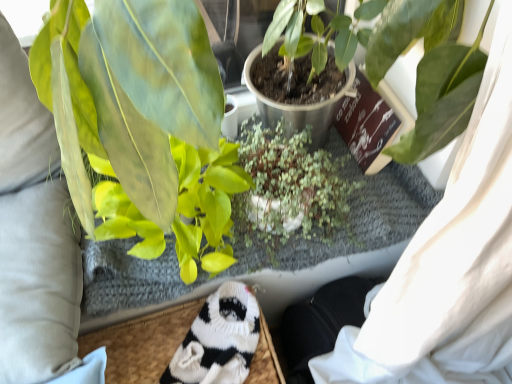
What is the approximate height of white knitted socks at lower center?

2.98 inches.

Identify the location of white knitted socks at lower center. This screenshot has width=512, height=384. (218, 340).

This screenshot has width=512, height=384. I want to click on white knitted socks at lower left, so click(35, 237).

You are a GUI agent. You are given a task and a screenshot of the screen. Output one action in this format:
    pyautogui.click(x=<x>, y=<y>)
    Task: Click on the green matte leafy plant at left, which ranks as the second houseplant in front-to-back order
    The height and width of the screenshot is (384, 512).
    Given the screenshot: What is the action you would take?
    pyautogui.click(x=130, y=95)

From a real-world perspective, who is located higher, green matte leafy plant at left, the second houseplant positioned from the back, or white knitted socks at lower left?

In real-world perspective, green matte leafy plant at left, the second houseplant positioned from the back, is above.

Does point (165, 168) lie behind point (42, 113)?

No, it is not.

Locate an element on the screen. This screenshot has width=512, height=384. clothing located behind the green matte leafy plant at left, which ranks as the second houseplant in front-to-back order is located at coordinates (35, 237).

From the image's perspective, between green matte leafy plant at left, the second houseplant positioned from the back, and white knitted socks at lower left, who is located below?

From the image's view, white knitted socks at lower left is below.

Is green matte plant at center, positioned as the 3th houseplant in back-to-front order, positioned with its back to white knitted socks at lower center?

No.

Is point (393, 5) closer or farther from the camera than point (213, 314)?

Point (393, 5) is positioned closer to the camera compared to point (213, 314).

Would you say green matte plant at center, positioned as the 3th houseplant in back-to-front order, is outside white knitted socks at lower center?

green matte plant at center, positioned as the 3th houseplant in back-to-front order, is positioned outside white knitted socks at lower center.

Is white knitted socks at lower left positioned with its back to green matte plant at center, positioned as the third houseplant in front-to-back order?

No, white knitted socks at lower left's orientation is not away from green matte plant at center, positioned as the third houseplant in front-to-back order.

The image size is (512, 384). There is a white knitted socks at lower left. In order to click on the 1st houseplant above it (from a real-world perspective) in this screenshot , I will do `click(289, 189)`.

Considering the relative sizes of white knitted socks at lower left and green matte plant at center, positioned as the third houseplant in front-to-back order, in the image provided, is white knitted socks at lower left thinner than green matte plant at center, positioned as the third houseplant in front-to-back order,?

Indeed, white knitted socks at lower left has a lesser width compared to green matte plant at center, positioned as the third houseplant in front-to-back order.

Is point (70, 260) farther from camera compared to point (256, 169)?

That is False.

Is green matte leafy plant at left, which ranks as the second houseplant in front-to-back order, smaller than green matte plant at center, positioned as the third houseplant in front-to-back order?

Incorrect, green matte leafy plant at left, which ranks as the second houseplant in front-to-back order, is not smaller in size than green matte plant at center, positioned as the third houseplant in front-to-back order.

Which of these two, green matte leafy plant at left, which ranks as the second houseplant in front-to-back order, or green matte plant at center, positioned as the third houseplant in front-to-back order, stands shorter?

green matte plant at center, positioned as the third houseplant in front-to-back order, is shorter.

Looking at this image, which point is more distant from viewer, [177,89] or [332,183]?

Point [332,183]

Is the position of green matte leafy plant at left, the second houseplant positioned from the back, more distant than that of green matte plant at center, positioned as the third houseplant in front-to-back order?

No, it is not.

From a real-world perspective, is green matte plant at center, positioned as the 3th houseplant in back-to-front order, physically located above or below white knitted socks at lower left?

From a real-world perspective, green matte plant at center, positioned as the 3th houseplant in back-to-front order, is physically above white knitted socks at lower left.

Would you say green matte plant at center, positioned as the 3th houseplant in back-to-front order, contains white knitted socks at lower left?

Actually, white knitted socks at lower left is outside green matte plant at center, positioned as the 3th houseplant in back-to-front order.

Looking at this image, considering the sizes of objects green matte plant at center, the 1th houseplant when ordered from front to back, and white knitted socks at lower left in the image provided, who is shorter, green matte plant at center, the 1th houseplant when ordered from front to back, or white knitted socks at lower left?

Standing shorter between the two is white knitted socks at lower left.

From the image's perspective, relative to white knitted socks at lower left, is green matte plant at center, the 1th houseplant when ordered from front to back, above or below?

green matte plant at center, the 1th houseplant when ordered from front to back, is situated higher than white knitted socks at lower left in the image.

Which is nearer, (190, 37) or (244, 354)?

Point (190, 37) appears to be closer to the viewer than point (244, 354).

Considering the relative sizes of green matte leafy plant at left, the second houseplant positioned from the back, and white knitted socks at lower center in the image provided, is green matte leafy plant at left, the second houseplant positioned from the back, smaller than white knitted socks at lower center?

Actually, green matte leafy plant at left, the second houseplant positioned from the back, might be larger than white knitted socks at lower center.

Find the location of a particular element. The image size is (512, 384). houseplant on the left of white knitted socks at lower center is located at coordinates (130, 95).

Does white knitted socks at lower center appear on the left side of white knitted socks at lower left?

In fact, white knitted socks at lower center is to the right of white knitted socks at lower left.

From a real-world perspective, is white knitted socks at lower center positioned above or below white knitted socks at lower left?

Clearly, from a real-world perspective, white knitted socks at lower center is below white knitted socks at lower left.

Is white knitted socks at lower center inside or outside of white knitted socks at lower left?

white knitted socks at lower center is outside white knitted socks at lower left.

This screenshot has height=384, width=512. What are the coordinates of `clothing located below the green matte leafy plant at left, which ranks as the second houseplant in front-to-back order (from the image's perspective)` in the screenshot? It's located at (35, 237).

Where is `animal below the green matte plant at center, the 1th houseplant when ordered from front to back (from a real-world perspective)`? The height and width of the screenshot is (384, 512). animal below the green matte plant at center, the 1th houseplant when ordered from front to back (from a real-world perspective) is located at coordinates click(x=218, y=340).

When comparing their distances from white knitted socks at lower left, does green matte plant at center, positioned as the 3th houseplant in back-to-front order, or green matte leafy plant at left, which ranks as the second houseplant in front-to-back order, seem further?

The object further to white knitted socks at lower left is green matte plant at center, positioned as the 3th houseplant in back-to-front order.

Considering their positions, is white knitted socks at lower center positioned further to white knitted socks at lower left than green matte plant at center, the 1th houseplant when ordered from front to back?

Based on the image, green matte plant at center, the 1th houseplant when ordered from front to back, appears to be further to white knitted socks at lower left.

Consider the image. Which object lies nearer to the anchor point green matte plant at center, positioned as the third houseplant in front-to-back order, white knitted socks at lower left or green matte plant at center, the 1th houseplant when ordered from front to back?

Based on the image, green matte plant at center, the 1th houseplant when ordered from front to back, appears to be nearer to green matte plant at center, positioned as the third houseplant in front-to-back order.

Looking at the image, which one is located further to green matte plant at center, positioned as the third houseplant in front-to-back order, white knitted socks at lower center or green matte plant at center, the 1th houseplant when ordered from front to back?

Based on the image, white knitted socks at lower center appears to be further to green matte plant at center, positioned as the third houseplant in front-to-back order.

Looking at the image, which one is located further to white knitted socks at lower center, white knitted socks at lower left or green matte leafy plant at left, the second houseplant positioned from the back?

green matte leafy plant at left, the second houseplant positioned from the back, is positioned further to the anchor white knitted socks at lower center.

Estimate the real-world distances between objects in this image. Which object is closer to white knitted socks at lower left, green matte leafy plant at left, the second houseplant positioned from the back, or green matte plant at center, which is the 1th houseplant in back-to-front order?

green matte leafy plant at left, the second houseplant positioned from the back, is positioned closer to the anchor white knitted socks at lower left.

Looking at the image, which one is located closer to white knitted socks at lower center, white knitted socks at lower left or green matte plant at center, which is the 1th houseplant in back-to-front order?

green matte plant at center, which is the 1th houseplant in back-to-front order, is positioned closer to the anchor white knitted socks at lower center.

From the image, which object appears to be farther from white knitted socks at lower left, white knitted socks at lower center or green matte plant at center, positioned as the third houseplant in front-to-back order?

Based on the image, green matte plant at center, positioned as the third houseplant in front-to-back order, appears to be further to white knitted socks at lower left.

The image size is (512, 384). Find the location of `clothing between green matte plant at center, the 1th houseplant when ordered from front to back, and white knitted socks at lower center from top to bottom`. clothing between green matte plant at center, the 1th houseplant when ordered from front to back, and white knitted socks at lower center from top to bottom is located at coordinates (35, 237).

I want to click on houseplant between green matte plant at center, positioned as the 3th houseplant in back-to-front order, and green matte plant at center, positioned as the third houseplant in front-to-back order, in the front-back direction, so click(130, 95).

Locate an element on the screen. The height and width of the screenshot is (384, 512). houseplant between green matte plant at center, positioned as the third houseplant in front-to-back order, and white knitted socks at lower center, in the vertical direction is located at coordinates (130, 95).

Find the location of a particular element. This screenshot has width=512, height=384. clothing between green matte leafy plant at left, which ranks as the second houseplant in front-to-back order, and white knitted socks at lower center vertically is located at coordinates (35, 237).